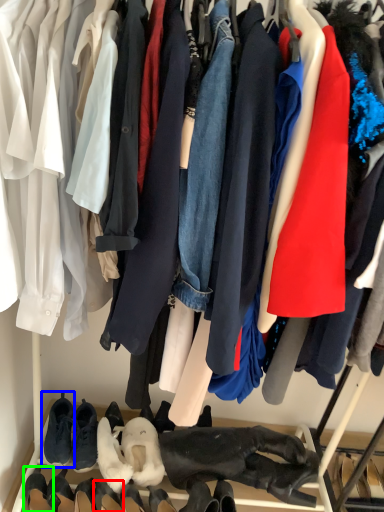
Question: Based on their relative distances, which object is nearer to footwear (highlighted by a red box)? Choose from footwear (highlighted by a blue box) and footwear (highlighted by a green box).

Choices:
 (A) footwear
 (B) footwear

Answer: (B)